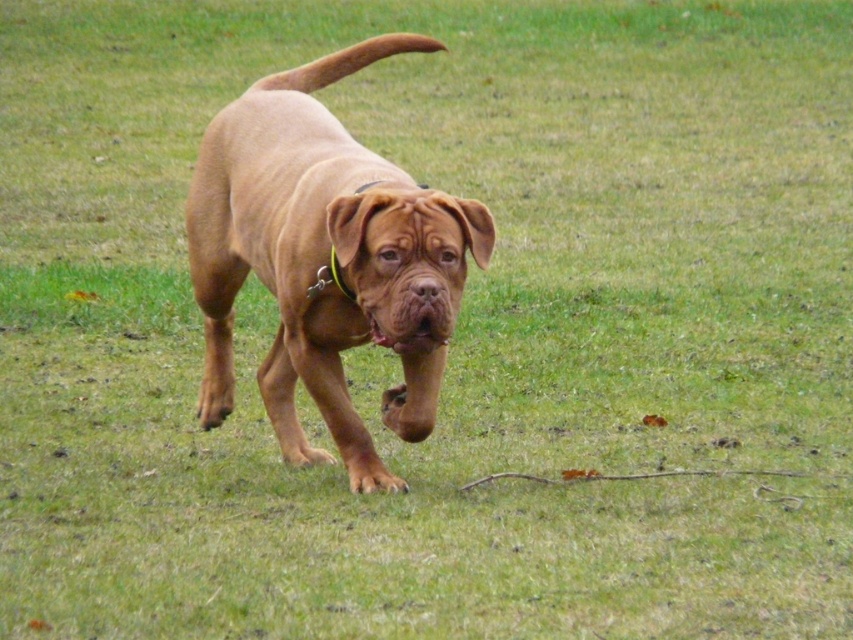
Does smooth brown dog at center lie behind green fabric collar at center?

No.

Is smooth brown dog at center smaller than green fabric collar at center?

No.

Locate an element on the screen. The width and height of the screenshot is (853, 640). smooth brown dog at center is located at coordinates (325, 259).

This screenshot has width=853, height=640. In order to click on smooth brown dog at center in this screenshot , I will do `click(325, 259)`.